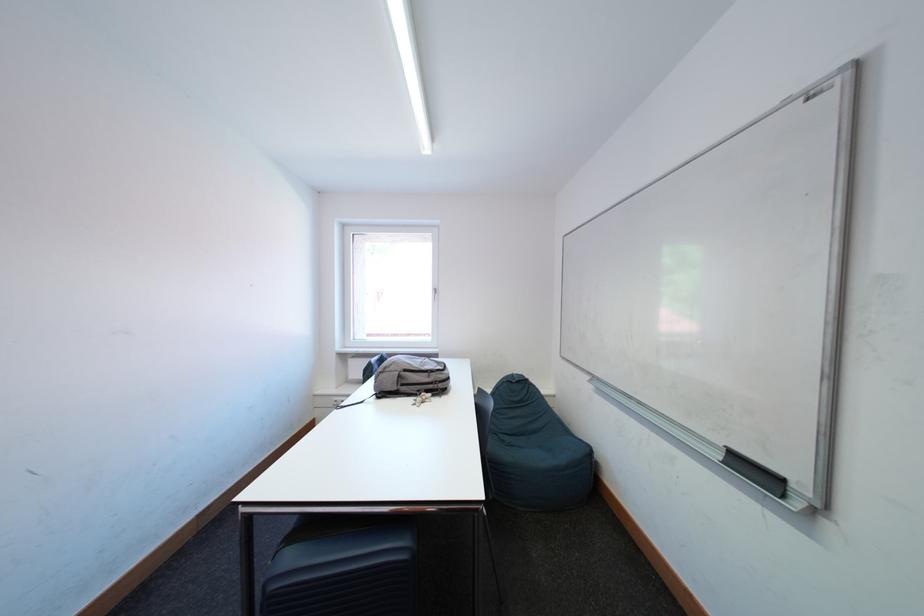
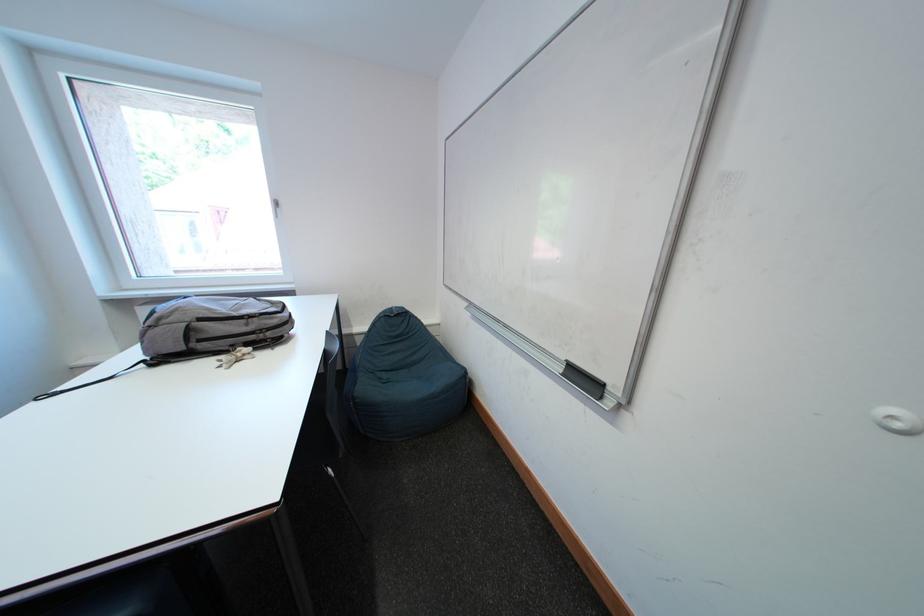
In the second image, find the point that corresponds to (x=516, y=440) in the first image.

(394, 379)